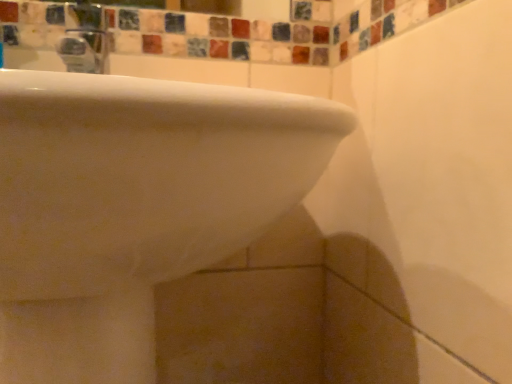
Question: Should I look upward or downward to see white glossy sink at upper left?

Choices:
 (A) up
 (B) down

Answer: (B)